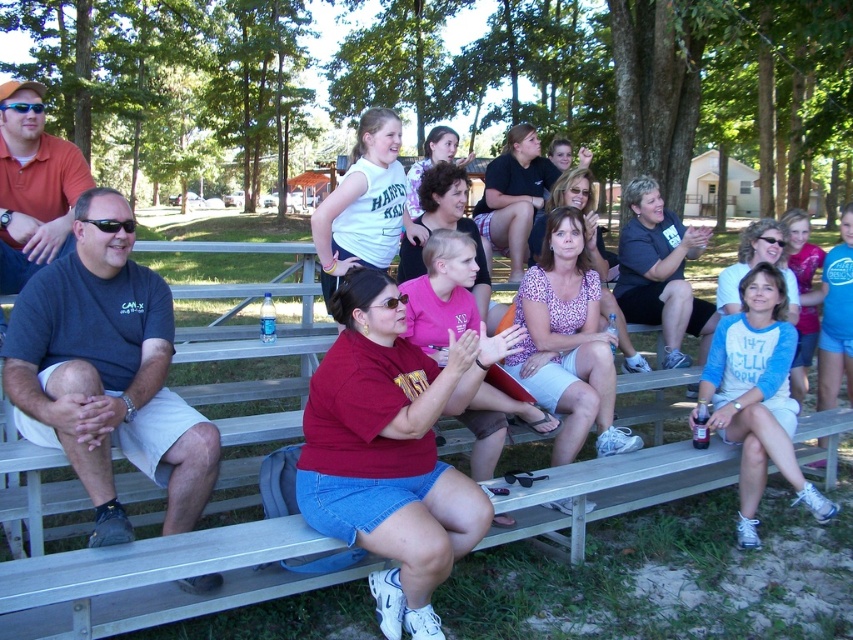
Question: Is dark gray t-shirt at left positioned at the back of white cotton shirt at center?

Choices:
 (A) yes
 (B) no

Answer: (B)

Question: Among these objects, which one is farthest from the camera?

Choices:
 (A) white cotton shirt at center
 (B) dark gray t-shirt at left

Answer: (A)

Question: Among these points, which one is nearest to the camera?

Choices:
 (A) (18, 349)
 (B) (705, 422)

Answer: (A)

Question: Does dark gray t-shirt at left have a smaller size compared to white cotton shirt at center?

Choices:
 (A) no
 (B) yes

Answer: (A)

Question: Observing the image, what is the correct spatial positioning of dark gray t-shirt at left in reference to white cotton shirt at center?

Choices:
 (A) below
 (B) above

Answer: (B)